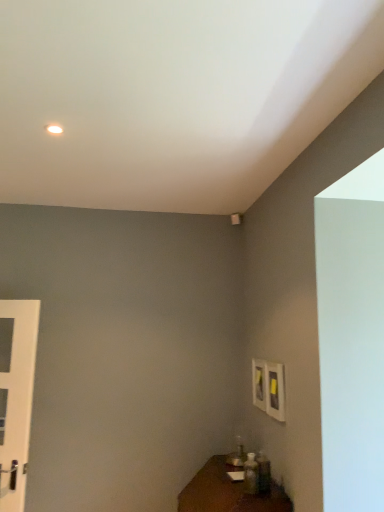
Question: Is white glossy door at left wider or thinner than brown wooden table at lower right?

Choices:
 (A) wide
 (B) thin

Answer: (B)

Question: Visually, is white glossy door at left positioned to the left or to the right of brown wooden table at lower right?

Choices:
 (A) left
 (B) right

Answer: (A)

Question: Considering their positions, is white glossy door at left located in front of or behind brown wooden table at lower right?

Choices:
 (A) front
 (B) behind

Answer: (B)

Question: From a real-world perspective, is brown wooden table at lower right positioned above or below white glossy door at left?

Choices:
 (A) above
 (B) below

Answer: (B)

Question: Considering the positions of brown wooden table at lower right and white glossy door at left in the image, is brown wooden table at lower right wider or thinner than white glossy door at left?

Choices:
 (A) wide
 (B) thin

Answer: (A)

Question: From the image's perspective, is brown wooden table at lower right positioned above or below white glossy door at left?

Choices:
 (A) above
 (B) below

Answer: (B)

Question: Considering the relative positions of brown wooden table at lower right and white glossy door at left in the image provided, is brown wooden table at lower right to the left or to the right of white glossy door at left?

Choices:
 (A) right
 (B) left

Answer: (A)